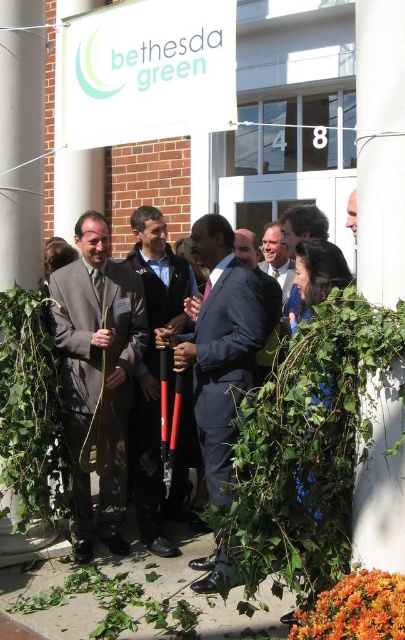
Question: Does navy blue suit at center have a lesser width compared to dark blue suit at center?

Choices:
 (A) yes
 (B) no

Answer: (B)

Question: Does matte gray suit at center appear over light brown suit at center?

Choices:
 (A) yes
 (B) no

Answer: (B)

Question: Is green leafy plant at center further to the viewer compared to orange matte flowers at lower right?

Choices:
 (A) no
 (B) yes

Answer: (B)

Question: Estimate the real-world distances between objects in this image. Which object is farther from the green leafy plant at center?

Choices:
 (A) green leafy plant at lower center
 (B) green leafy vine at left
 (C) dark blue suit at center
 (D) black rubber tool at center

Answer: (B)

Question: Which point appears farthest from the camera in this image?

Choices:
 (A) (307, 614)
 (B) (268, 301)
 (C) (144, 257)
 (D) (110, 624)

Answer: (C)

Question: Which point is farther to the camera?

Choices:
 (A) light brown suit at center
 (B) navy blue suit at center
 (C) matte gray suit at center

Answer: (A)